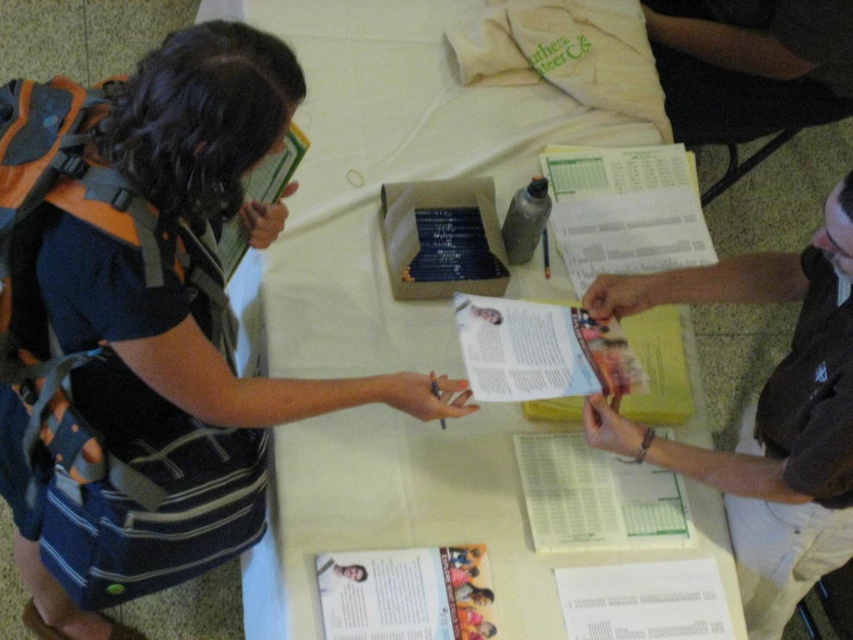
Question: Is the position of white paper at center less distant than that of dark brown leather wallet at center?

Choices:
 (A) yes
 (B) no

Answer: (B)

Question: Which of these objects is positioned farthest from the matte black backpack at left?

Choices:
 (A) dark brown leather wallet at center
 (B) white paper at center

Answer: (A)

Question: Which of these objects is positioned closest to the matte black backpack at left?

Choices:
 (A) white paper at center
 (B) dark brown leather wallet at center

Answer: (A)

Question: Does white paper at center appear on the right side of dark brown leather wallet at center?

Choices:
 (A) no
 (B) yes

Answer: (A)

Question: Observing the image, what is the correct spatial positioning of white paper at center in reference to dark brown leather wallet at center?

Choices:
 (A) above
 (B) below

Answer: (A)

Question: Which point appears closest to the camera in this image?

Choices:
 (A) (387, 374)
 (B) (834, 556)

Answer: (A)